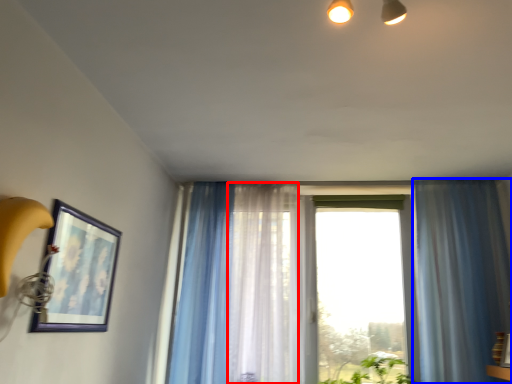
Question: Which of the following is the closest to the observer, curtain (highlighted by a red box) or curtain (highlighted by a blue box)?

Choices:
 (A) curtain
 (B) curtain

Answer: (B)